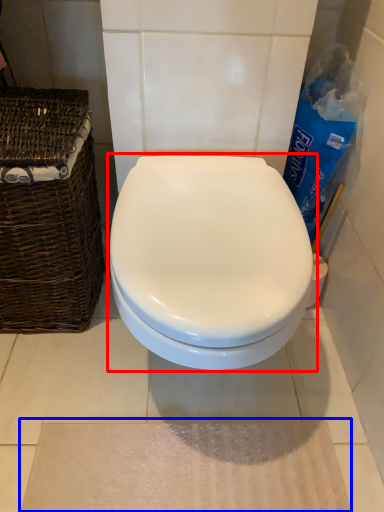
Question: Which of the following is the farthest to the observer, toilet (highlighted by a red box) or bath mat (highlighted by a blue box)?

Choices:
 (A) toilet
 (B) bath mat

Answer: (B)